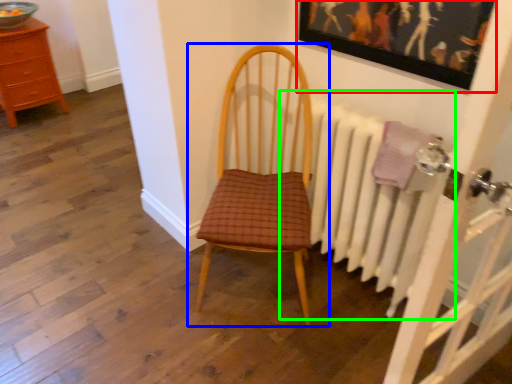
Question: Estimate the real-world distances between objects in this image. Which object is farther from picture frame (highlighted by a red box), chair (highlighted by a blue box) or radiator (highlighted by a green box)?

Choices:
 (A) chair
 (B) radiator

Answer: (A)